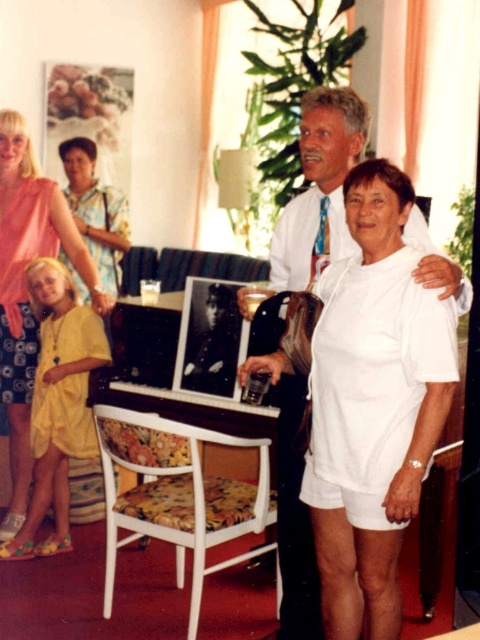
Is white cotton shirt at center behind yellow cotton dress at lower left?

No, it is in front of yellow cotton dress at lower left.

Does white cotton shirt at center appear under yellow cotton dress at lower left?

No.

Describe the element at coordinates (316, 193) in the screenshot. I see `white cotton shirt at center` at that location.

Locate an element on the screen. white cotton shirt at center is located at coordinates (316, 193).

Does white cotton shirt at center appear over matte pink blouse at upper left?

Incorrect, white cotton shirt at center is not positioned above matte pink blouse at upper left.

Can you confirm if white cotton shirt at center is positioned to the left of matte pink blouse at upper left?

Incorrect, white cotton shirt at center is not on the left side of matte pink blouse at upper left.

Does point (420, 260) lie behind point (119, 285)?

No, it is in front of (119, 285).

Locate an element on the screen. This screenshot has width=480, height=640. white cotton shirt at center is located at coordinates (316, 193).

Does yellow cotton dress at lower left have a greater height compared to matte pink blouse at upper left?

Yes, yellow cotton dress at lower left is taller than matte pink blouse at upper left.

Between yellow cotton dress at lower left and matte pink blouse at upper left, which one appears on the left side from the viewer's perspective?

matte pink blouse at upper left

This screenshot has width=480, height=640. In order to click on yellow cotton dress at lower left in this screenshot , I will do `click(58, 403)`.